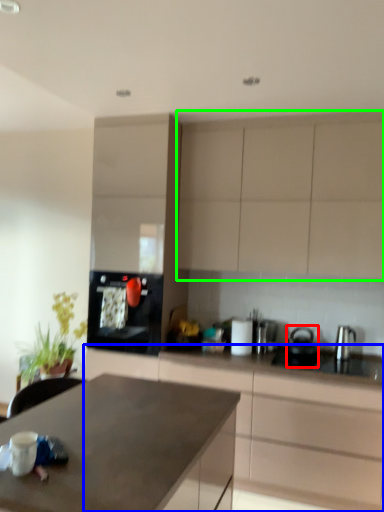
Question: Based on their relative distances, which object is farther from kitchen appliance (highlighted by a red box)? Choose from cabinetry (highlighted by a blue box) and cabinetry (highlighted by a green box).

Choices:
 (A) cabinetry
 (B) cabinetry

Answer: (B)